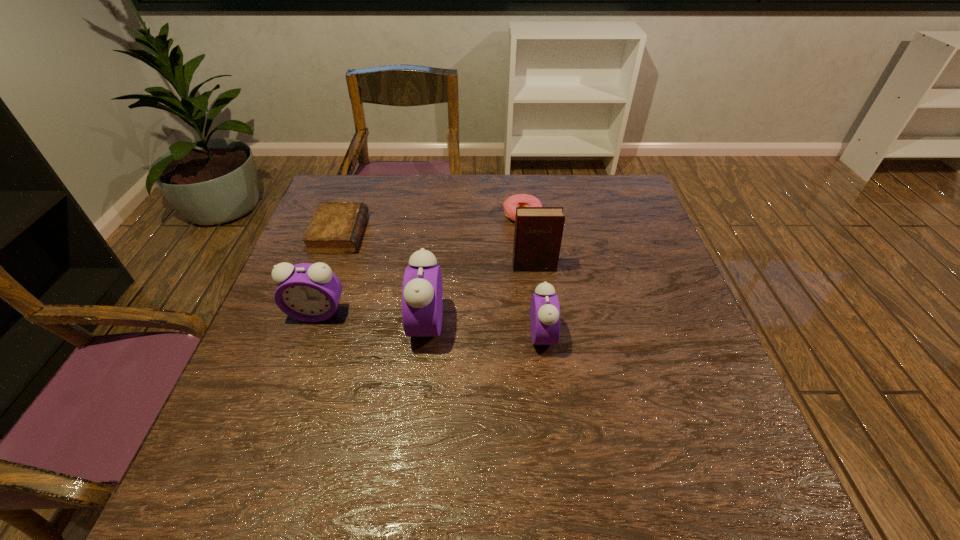
The height and width of the screenshot is (540, 960). Find the location of `alarm clock at the left edge`. alarm clock at the left edge is located at coordinates (308, 292).

Where is `diary that is positioned at the left edge`? The width and height of the screenshot is (960, 540). diary that is positioned at the left edge is located at coordinates (336, 227).

Locate an element on the screen. This screenshot has width=960, height=540. object that is at the far left corner is located at coordinates (336, 227).

The image size is (960, 540). I want to click on free space at the far edge of the desktop, so click(575, 175).

Locate an element on the screen. The width and height of the screenshot is (960, 540). vacant space at the near edge of the desktop is located at coordinates (652, 422).

This screenshot has width=960, height=540. In the image, there is a desktop. What are the coordinates of `vacant space at the right edge` in the screenshot? It's located at (651, 225).

Locate an element on the screen. The image size is (960, 540). free space at the far right corner of the desktop is located at coordinates pos(597,206).

Identify the location of vacant area between the leftmost alarm clock and the third object from left to right. The height and width of the screenshot is (540, 960). click(x=372, y=319).

Find the location of a particular element. Image resolution: width=960 pixels, height=540 pixels. vacant space in between the third object from left to right and the farther diary is located at coordinates (383, 279).

Where is `free space between the third object from left to right and the taller diary`? Image resolution: width=960 pixels, height=540 pixels. free space between the third object from left to right and the taller diary is located at coordinates (480, 295).